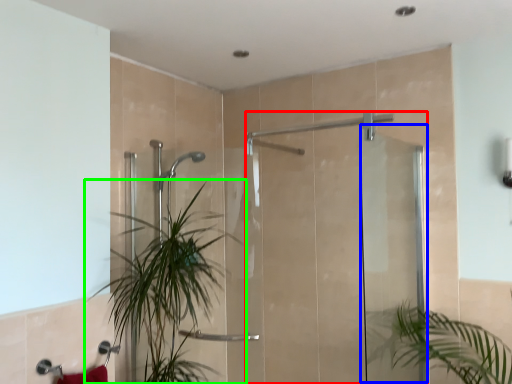
Question: Which object is positioned closest to screen door (highlighted by a red box)? Select from screen door (highlighted by a blue box) and houseplant (highlighted by a green box).

Choices:
 (A) screen door
 (B) houseplant

Answer: (A)